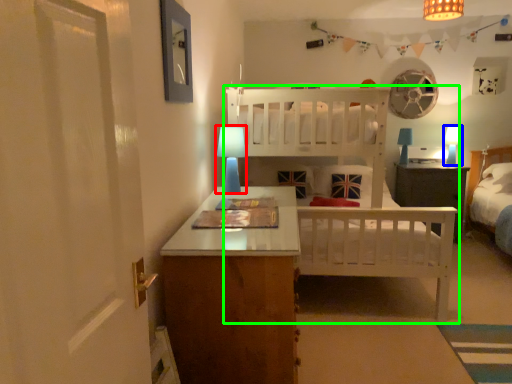
Question: Considering the real-world distances, which object is farthest from table lamp (highlighted by a red box)? table lamp (highlighted by a blue box) or bed (highlighted by a green box)?

Choices:
 (A) table lamp
 (B) bed

Answer: (A)